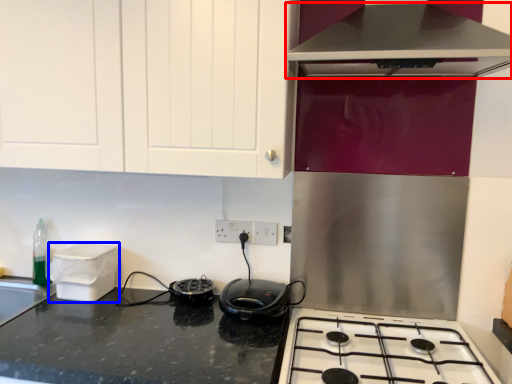
Question: Which point is further to the camera, home appliance (highlighted by a red box) or appliance (highlighted by a blue box)?

Choices:
 (A) home appliance
 (B) appliance

Answer: (B)